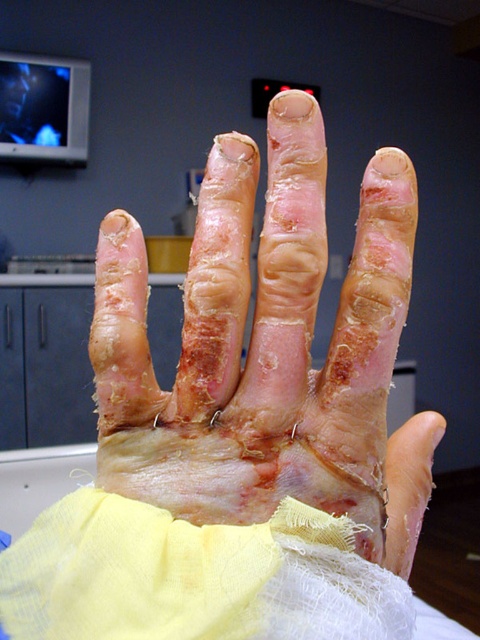
Between dry skin at center and yellow gauze at lower left, which one has less height?

yellow gauze at lower left is shorter.

Is dry skin at center below yellow gauze at lower left?

No.

What do you see at coordinates (267, 349) in the screenshot?
I see `dry skin at center` at bounding box center [267, 349].

At what (x,y) coordinates should I click in order to perform the action: click on dry skin at center. Please return your answer as a coordinate pair (x, y). The height and width of the screenshot is (640, 480). Looking at the image, I should click on (267, 349).